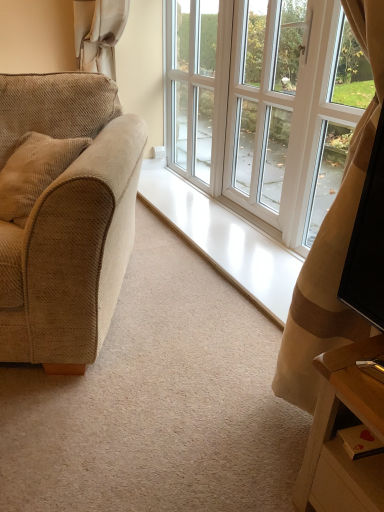
The height and width of the screenshot is (512, 384). What do you see at coordinates (264, 104) in the screenshot?
I see `white glass window at center` at bounding box center [264, 104].

Describe the element at coordinates (193, 87) in the screenshot. This screenshot has height=512, width=384. I see `white glass screen door at upper center, acting as the second screen door starting from the right` at that location.

Identify the location of white glass window at center. (264, 104).

From the image's perspective, between white glass window at center and beige corduroy couch at left, who is located below?

white glass window at center appears lower in the image.

How many degrees apart are the facing directions of white glass window at center and beige corduroy couch at left?

The facing directions of white glass window at center and beige corduroy couch at left are 63.2 degrees apart.

Which of these two, white glass window at center or beige corduroy couch at left, is smaller?

white glass window at center.

Which is in front, white glass window at center or beige corduroy couch at left?

white glass window at center.

Between white glossy screen door at center, which is the 2th screen door from left to right, and white glass screen door at upper center, acting as the second screen door starting from the right, which one has smaller width?

Thinner between the two is white glass screen door at upper center, acting as the second screen door starting from the right.

You are a GUI agent. You are given a task and a screenshot of the screen. Output one action in this format:
    pyautogui.click(x=<x>, y=<y>)
    Task: Click on the screen door below the white glass screen door at upper center, acting as the second screen door starting from the right (from the image's perspective)
    This screenshot has width=384, height=512.
    Given the screenshot: What is the action you would take?
    pyautogui.click(x=262, y=101)

From the image's perspective, is white glossy screen door at center, which is the 2th screen door from left to right, above white glass screen door at upper center, the first screen door in the left-to-right sequence?

Actually, white glossy screen door at center, which is the 2th screen door from left to right, appears below white glass screen door at upper center, the first screen door in the left-to-right sequence, in the image.

Based on their positions, is white glossy screen door at center, acting as the 1th screen door starting from the right, located to the left or right of white glass screen door at upper center, the first screen door in the left-to-right sequence?

white glossy screen door at center, acting as the 1th screen door starting from the right, is positioned on white glass screen door at upper center, the first screen door in the left-to-right sequence,'s right side.

Can you see white glass window at center touching white glass screen door at upper center, acting as the second screen door starting from the right?

No, white glass window at center is not in contact with white glass screen door at upper center, acting as the second screen door starting from the right.

Considering the sizes of objects white glass window at center and white glass screen door at upper center, the first screen door in the left-to-right sequence, in the image provided, who is shorter, white glass window at center or white glass screen door at upper center, the first screen door in the left-to-right sequence,?

With less height is white glass window at center.

Looking at the image, does white glass window at center seem bigger or smaller compared to white glass screen door at upper center, acting as the second screen door starting from the right?

In the image, white glass window at center appears to be larger than white glass screen door at upper center, acting as the second screen door starting from the right.

Consider the image. Do you think white glass window at center is within white glass screen door at upper center, the first screen door in the left-to-right sequence, or outside of it?

white glass window at center is outside white glass screen door at upper center, the first screen door in the left-to-right sequence.

In the scene shown: Considering the relative positions of white glass screen door at upper center, the first screen door in the left-to-right sequence, and white glass window at center in the image provided, is white glass screen door at upper center, the first screen door in the left-to-right sequence, behind white glass window at center?

Yes, white glass screen door at upper center, the first screen door in the left-to-right sequence, is further from the camera.

Is white glass screen door at upper center, acting as the second screen door starting from the right, positioned with its back to white glass window at center?

No, white glass window at center is not at the back of white glass screen door at upper center, acting as the second screen door starting from the right.

Is white glass screen door at upper center, the first screen door in the left-to-right sequence, not inside white glass window at center?

white glass screen door at upper center, the first screen door in the left-to-right sequence, lies outside white glass window at center's area.

Considering the positions of point (180, 138) and point (342, 149), is point (180, 138) closer or farther from the camera than point (342, 149)?

Point (180, 138) is positioned farther from the camera compared to point (342, 149).

Could you tell me if white glass screen door at upper center, the first screen door in the left-to-right sequence, is turned towards white glossy screen door at center, acting as the 1th screen door starting from the right?

No, white glass screen door at upper center, the first screen door in the left-to-right sequence, is not facing towards white glossy screen door at center, acting as the 1th screen door starting from the right.

Does white glass screen door at upper center, the first screen door in the left-to-right sequence, contain white glossy screen door at center, which is the 2th screen door from left to right?

Definitely not — white glossy screen door at center, which is the 2th screen door from left to right, is not inside white glass screen door at upper center, the first screen door in the left-to-right sequence.

Is white glass screen door at upper center, acting as the second screen door starting from the right, to the left of white glossy screen door at center, acting as the 1th screen door starting from the right, from the viewer's perspective?

Correct, you'll find white glass screen door at upper center, acting as the second screen door starting from the right, to the left of white glossy screen door at center, acting as the 1th screen door starting from the right.

Locate an element on the screen. screen door below the white glossy screen door at center, acting as the 1th screen door starting from the right (from a real-world perspective) is located at coordinates (193, 87).

Which is closer, (98, 300) or (194, 180)?

Point (98, 300) appears to be closer to the viewer than point (194, 180).

Between beige corduroy couch at left and white glass screen door at upper center, acting as the second screen door starting from the right, which one has more height?

Standing taller between the two is white glass screen door at upper center, acting as the second screen door starting from the right.

Is beige corduroy couch at left outside of white glass screen door at upper center, the first screen door in the left-to-right sequence?

Yes, beige corduroy couch at left is not within white glass screen door at upper center, the first screen door in the left-to-right sequence.

Does white glass window at center turn towards white glossy screen door at center, which is the 2th screen door from left to right?

No, white glass window at center is not facing towards white glossy screen door at center, which is the 2th screen door from left to right.

From the image's perspective, which one is positioned lower, white glass window at center or white glossy screen door at center, acting as the 1th screen door starting from the right?

white glass window at center.

Is white glossy screen door at center, which is the 2th screen door from left to right, inside white glass window at center?

No, white glossy screen door at center, which is the 2th screen door from left to right, is not inside white glass window at center.

Which of these two, white glass window at center or white glossy screen door at center, which is the 2th screen door from left to right, is thinner?

white glossy screen door at center, which is the 2th screen door from left to right.

Locate an element on the screen. The width and height of the screenshot is (384, 512). window that is above the beige corduroy couch at left (from a real-world perspective) is located at coordinates (264, 104).

Identify the location of screen door above the white glossy screen door at center, which is the 2th screen door from left to right (from the image's perspective). [x=193, y=87].

Based on their spatial positions, is white glass screen door at upper center, acting as the second screen door starting from the right, or beige corduroy couch at left further from white glass window at center?

Based on the image, beige corduroy couch at left appears to be further to white glass window at center.

Looking at the image, which one is located further to beige corduroy couch at left, white glass screen door at upper center, the first screen door in the left-to-right sequence, or white glass window at center?

The object further to beige corduroy couch at left is white glass screen door at upper center, the first screen door in the left-to-right sequence.

Looking at the image, which one is located closer to white glossy screen door at center, acting as the 1th screen door starting from the right, white glass window at center or white glass screen door at upper center, acting as the second screen door starting from the right?

white glass window at center is positioned closer to the anchor white glossy screen door at center, acting as the 1th screen door starting from the right.

From the image, which object appears to be nearer to white glass window at center, white glass screen door at upper center, the first screen door in the left-to-right sequence, or white glossy screen door at center, which is the 2th screen door from left to right?

Among the two, white glossy screen door at center, which is the 2th screen door from left to right, is located nearer to white glass window at center.

When comparing their distances from white glass screen door at upper center, acting as the second screen door starting from the right, does white glass window at center or beige corduroy couch at left seem further?

beige corduroy couch at left is further to white glass screen door at upper center, acting as the second screen door starting from the right.

Estimate the real-world distances between objects in this image. Which object is further from beige corduroy couch at left, white glass window at center or white glossy screen door at center, acting as the 1th screen door starting from the right?

The object further to beige corduroy couch at left is white glossy screen door at center, acting as the 1th screen door starting from the right.

Considering their positions, is white glossy screen door at center, which is the 2th screen door from left to right, positioned closer to beige corduroy couch at left than white glass screen door at upper center, acting as the second screen door starting from the right?

Among the two, white glossy screen door at center, which is the 2th screen door from left to right, is located nearer to beige corduroy couch at left.

Estimate the real-world distances between objects in this image. Which object is further from beige corduroy couch at left, white glass window at center or white glass screen door at upper center, the first screen door in the left-to-right sequence?

white glass screen door at upper center, the first screen door in the left-to-right sequence, is positioned further to the anchor beige corduroy couch at left.

Find the location of a particular element. The image size is (384, 512). studio couch between white glass window at center and white glass screen door at upper center, the first screen door in the left-to-right sequence, from front to back is located at coordinates (63, 215).

You are a GUI agent. You are given a task and a screenshot of the screen. Output one action in this format:
    pyautogui.click(x=<x>, y=<y>)
    Task: Click on the screen door between white glass window at center and white glass screen door at upper center, the first screen door in the left-to-right sequence, from front to back
    The height and width of the screenshot is (512, 384).
    Given the screenshot: What is the action you would take?
    pyautogui.click(x=262, y=101)

This screenshot has width=384, height=512. Find the location of `screen door between beige corduroy couch at left and white glass screen door at upper center, acting as the second screen door starting from the right, in the front-back direction`. screen door between beige corduroy couch at left and white glass screen door at upper center, acting as the second screen door starting from the right, in the front-back direction is located at coordinates (262, 101).

Image resolution: width=384 pixels, height=512 pixels. I want to click on studio couch between white glass window at center and white glossy screen door at center, which is the 2th screen door from left to right, from front to back, so click(63, 215).